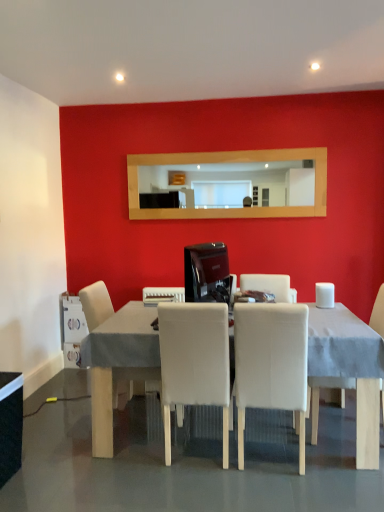
Question: Is the position of white plastic toaster at lower center, placed as the 2th appliance when sorted from top to bottom, less distant than that of white leather chair at center, which ranks as the second chair in left-to-right order?

Choices:
 (A) no
 (B) yes

Answer: (A)

Question: Are white plastic toaster at lower center, which is the second appliance in back-to-front order, and white leather chair at center, which ranks as the second chair in left-to-right order, located far from each other?

Choices:
 (A) no
 (B) yes

Answer: (A)

Question: From a real-world perspective, is white plastic toaster at lower center, placed as the 2th appliance when sorted from top to bottom, on white leather chair at center, which ranks as the second chair in left-to-right order?

Choices:
 (A) yes
 (B) no

Answer: (A)

Question: Is white plastic toaster at lower center, which appears as the 2th appliance when ordered from the bottom, in contact with white leather chair at center, which ranks as the second chair in left-to-right order?

Choices:
 (A) yes
 (B) no

Answer: (B)

Question: Can you confirm if white plastic toaster at lower center, arranged as the 2th appliance when viewed from the right, is thinner than white leather chair at center, which ranks as the second chair in left-to-right order?

Choices:
 (A) yes
 (B) no

Answer: (A)

Question: Is white plastic toaster at lower center, which ranks as the 2th appliance in front-to-back order, taller than white leather chair at center, which appears as the 3th chair when viewed from the right?

Choices:
 (A) yes
 (B) no

Answer: (B)

Question: From a real-world perspective, is wooden mirror at upper center beneath white fabric table at center, placed as the 2th table when sorted from left to right?

Choices:
 (A) no
 (B) yes

Answer: (A)

Question: Can you confirm if wooden mirror at upper center is thinner than white fabric table at center, which is the 1th table from right to left?

Choices:
 (A) yes
 (B) no

Answer: (A)

Question: From the image's perspective, is wooden mirror at upper center on top of white fabric table at center, which is the 1th table from right to left?

Choices:
 (A) yes
 (B) no

Answer: (A)

Question: Is the surface of wooden mirror at upper center in direct contact with white fabric table at center, which is the 1th table from right to left?

Choices:
 (A) yes
 (B) no

Answer: (B)

Question: Is wooden mirror at upper center not inside white fabric table at center, which is the 1th table from right to left?

Choices:
 (A) no
 (B) yes

Answer: (B)

Question: Can you confirm if wooden mirror at upper center is positioned to the right of white fabric table at center, placed as the 2th table when sorted from left to right?

Choices:
 (A) yes
 (B) no

Answer: (A)

Question: From a real-world perspective, is white fabric chair at center, the 2th chair from the right, physically above white plastic milk carton at lower left, the 1th appliance when ordered from bottom to top?

Choices:
 (A) no
 (B) yes

Answer: (B)